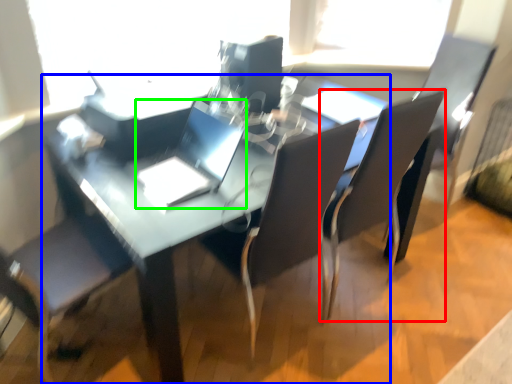
Question: Based on their relative distances, which object is nearer to chair (highlighted by a red box)? Choose from table (highlighted by a blue box) and laptop (highlighted by a green box).

Choices:
 (A) table
 (B) laptop

Answer: (A)